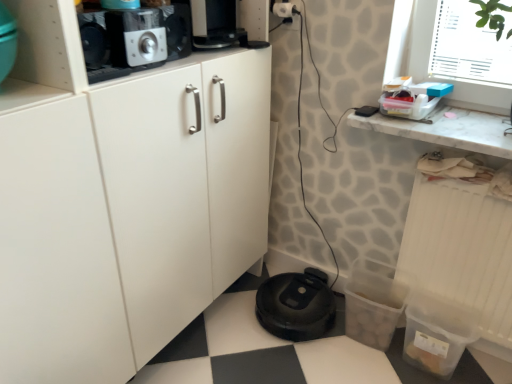
You are a GUI agent. You are given a task and a screenshot of the screen. Output one action in this format:
    pyautogui.click(x=<x>, y=<y>)
    Task: Click on the free space above transparent plastic container at lower right (from a real-world perspective)
    This screenshot has width=512, height=384.
    Given the screenshot: What is the action you would take?
    pyautogui.click(x=475, y=168)